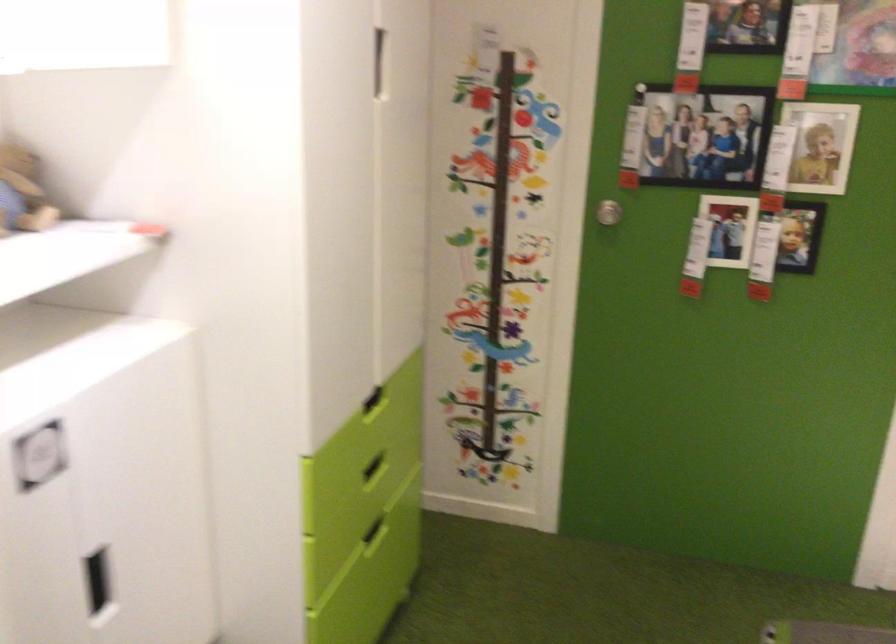
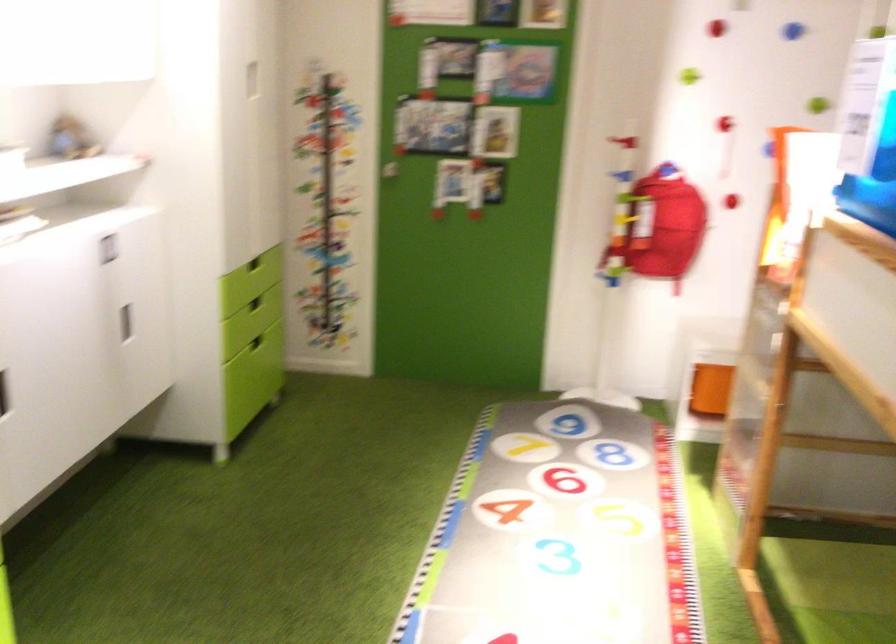
Question: Which direction would the cameraman need to move to produce the second image? Reply with the corresponding letter.

Choices:
 (A) Left
 (B) Right
 (C) Forward
 (D) Backward

Answer: (D)